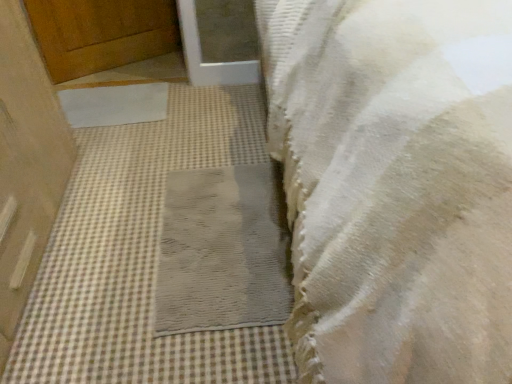
Image resolution: width=512 pixels, height=384 pixels. I want to click on vacant location behind gray textured mat at center, marked as the 1th mat in a right-to-left arrangement, so click(x=192, y=136).